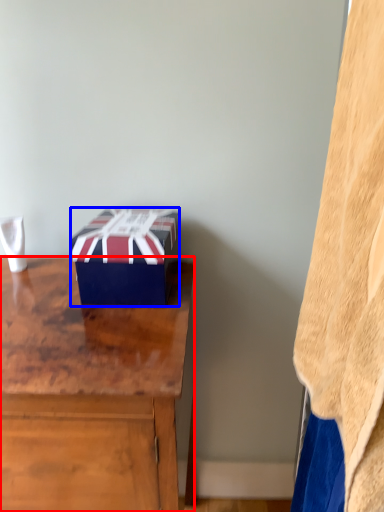
Question: Among these objects, which one is farthest to the camera, desk (highlighted by a red box) or box (highlighted by a blue box)?

Choices:
 (A) desk
 (B) box

Answer: (B)